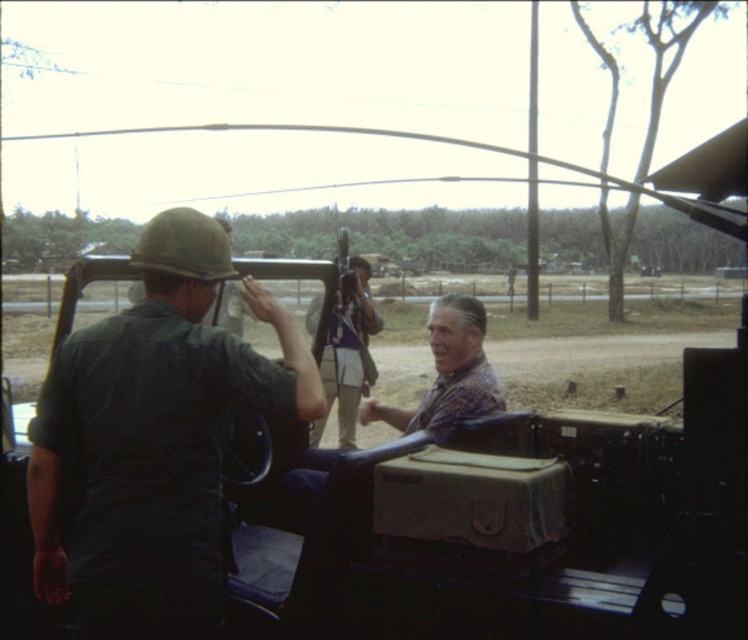
You are a photographer setting up a tripod in the center of the scene. You notice two people in the image, one wearing a dark green uniform at left and another in a plaid fabric shirt at center. Which person is positioned to your left?

The dark green uniform at left is positioned to your left side of the plaid fabric shirt at center, so the person in the dark green uniform at left is to your left.

You are a soldier in the field and need to quickly grab an item from the dark green uniform at left and the camouflage fabric rifle at center. Which item is closer to the ground?

The dark green uniform at left is shorter than the camouflage fabric rifle at center, so the dark green uniform at left is closer to the ground.